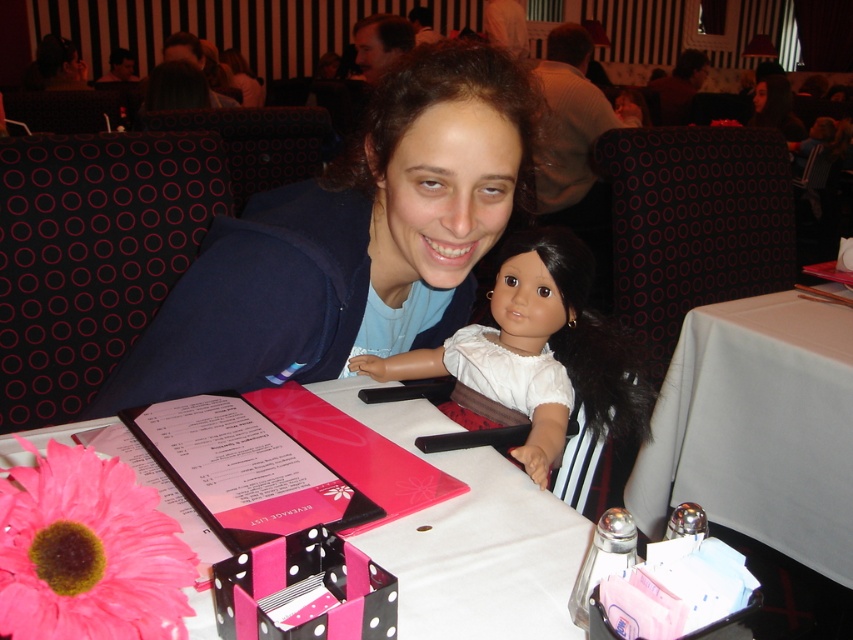
You are a customer at the restaurant and want to place a napkin on the table. You have a napkin that is 30 cm wide. The blue fabric at center is a tablecloth, and the white matte doll at center is sitting on it. Can the napkin fit entirely on the tablecloth without overlapping the doll?

The blue fabric at center has a larger width than the white matte doll at center. Since the tablecloth is wider than the doll, there is enough space to place the 30 cm napkin on the tablecloth without overlapping the doll, provided the napkin is placed in an area not occupied by the doll.